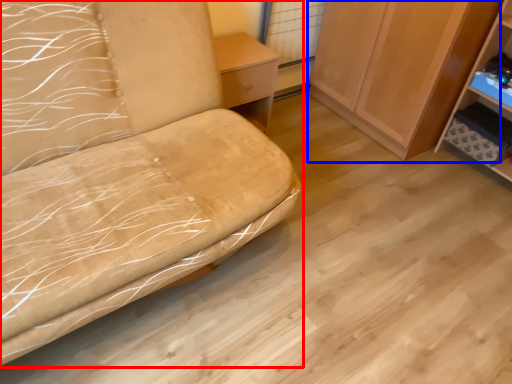
Question: Which point is closer to the camera, furniture (highlighted by a red box) or cabinetry (highlighted by a blue box)?

Choices:
 (A) furniture
 (B) cabinetry

Answer: (A)